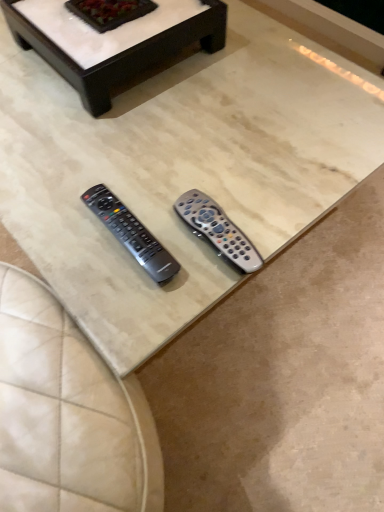
Locate an element on the screen. vacant area that is situated to the right of silver metallic remote at center, which ranks as the second remote control in right-to-left order is located at coordinates (223, 214).